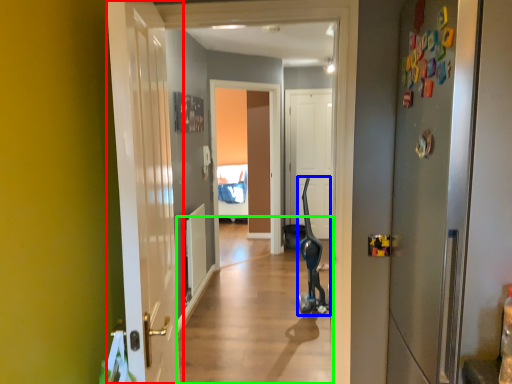
Question: Which object is positioned closest to door (highlighted by a red box)? Select from segway (highlighted by a blue box) and alley (highlighted by a green box).

Choices:
 (A) segway
 (B) alley

Answer: (B)